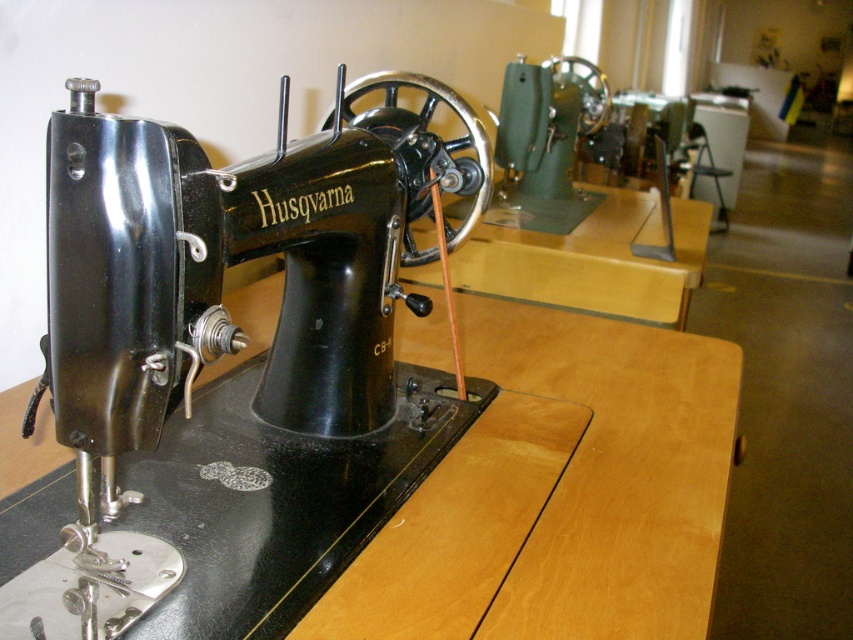
Does point (97, 252) come behind point (566, 316)?

No.

Does black metal sewing machine at center have a greater width compared to wooden table at center?

No.

Find the location of `black metal sewing machine at center`. black metal sewing machine at center is located at coordinates (229, 376).